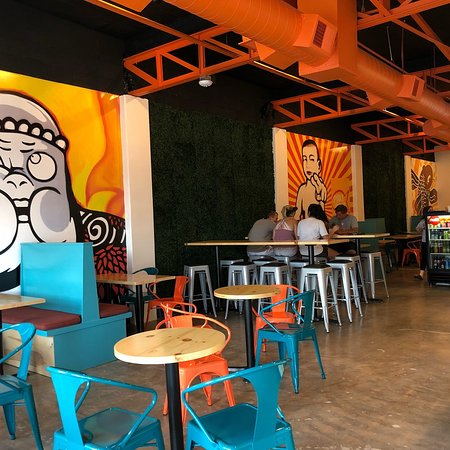
Locate an element on the screen. blue bench is located at coordinates (73, 279).